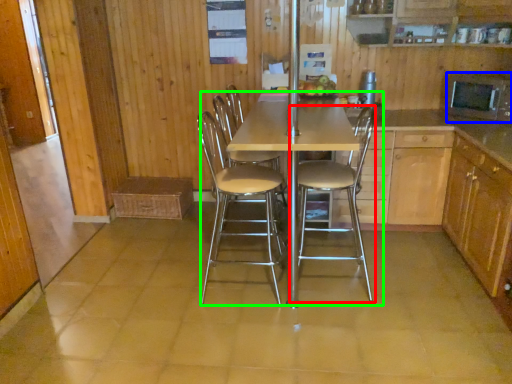
Question: Which object is the farthest from chair (highlighted by a red box)? Choose among these: appliance (highlighted by a blue box) or kitchen & dining room table (highlighted by a green box).

Choices:
 (A) appliance
 (B) kitchen & dining room table

Answer: (A)